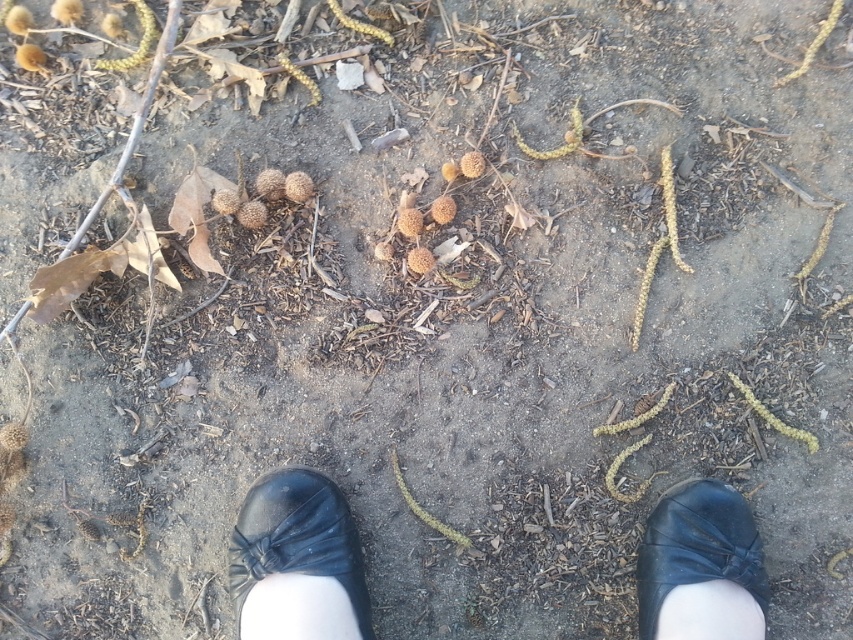
You are standing on the ground and looking down at the scene. You see the black leather shoes at center and the black leather shoe at lower center. Which one is shorter?

The black leather shoes at center is shorter than the black leather shoe at lower center.